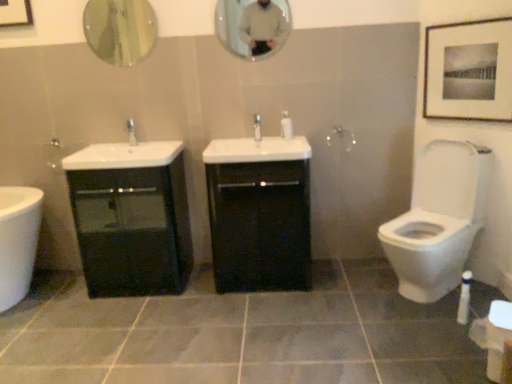
At what (x,y) coordinates should I click in order to perform the action: click on free spot to the left of white plastic toothbrush at lower right. Please return your answer as a coordinate pair (x, y). This screenshot has width=512, height=384. Looking at the image, I should click on (428, 322).